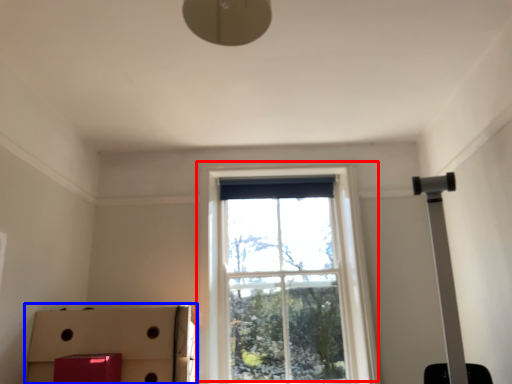
Question: Which object appears closest to the camera in this image, window (highlighted by a red box) or cardboard box (highlighted by a blue box)?

Choices:
 (A) window
 (B) cardboard box

Answer: (B)